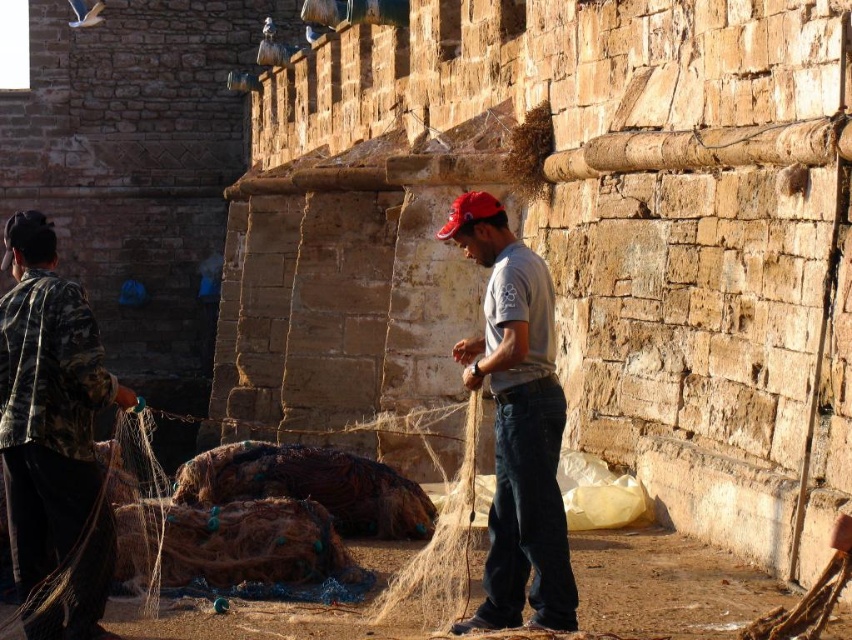
Does camo fabric jacket at left appear over red fabric baseball cap at center?

No, camo fabric jacket at left is not above red fabric baseball cap at center.

Which of these two, camo fabric jacket at left or red fabric baseball cap at center, stands taller?

camo fabric jacket at left

Does point (96, 572) come in front of point (494, 208)?

That is True.

Image resolution: width=852 pixels, height=640 pixels. What are the coordinates of `camo fabric jacket at left` in the screenshot? It's located at (53, 438).

Who is lower down, gray cotton shirt at center or red fabric baseball cap at center?

gray cotton shirt at center is below.

This screenshot has height=640, width=852. In order to click on gray cotton shirt at center in this screenshot , I will do `click(516, 422)`.

Is point (522, 296) positioned in front of point (459, 202)?

Yes, point (522, 296) is closer to viewer.

You are a GUI agent. You are given a task and a screenshot of the screen. Output one action in this format:
    pyautogui.click(x=<x>, y=<y>)
    Task: Click on the gray cotton shirt at center
    The height and width of the screenshot is (640, 852).
    Given the screenshot: What is the action you would take?
    coord(516,422)

Who is positioned more to the left, camo fabric jacket at left or gray cotton shirt at center?

camo fabric jacket at left

Between point (19, 490) and point (504, 321), which one is positioned behind?

Point (504, 321)

Is point (15, 291) farther from viewer compared to point (557, 506)?

Yes, it is behind point (557, 506).

This screenshot has height=640, width=852. Identify the location of camo fabric jacket at left. (53, 438).